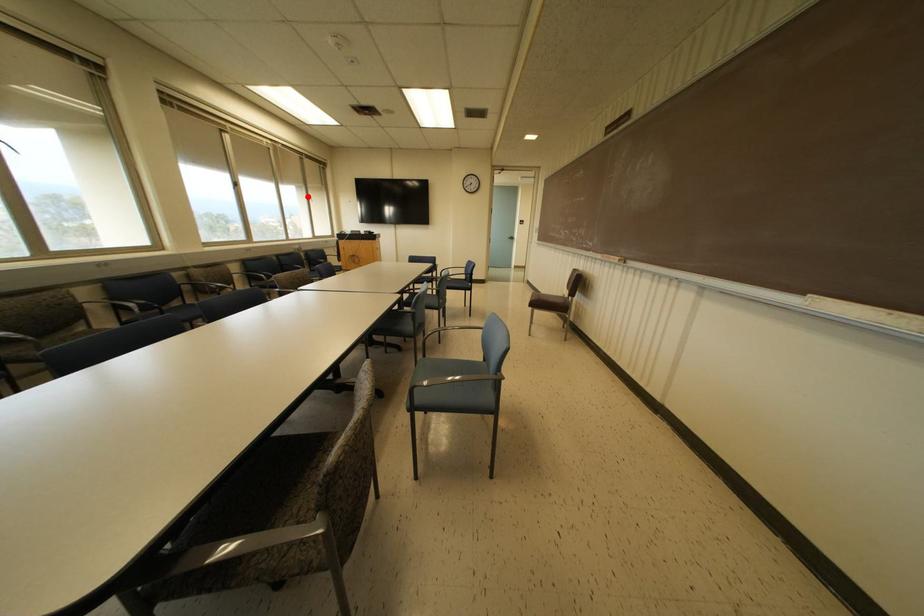
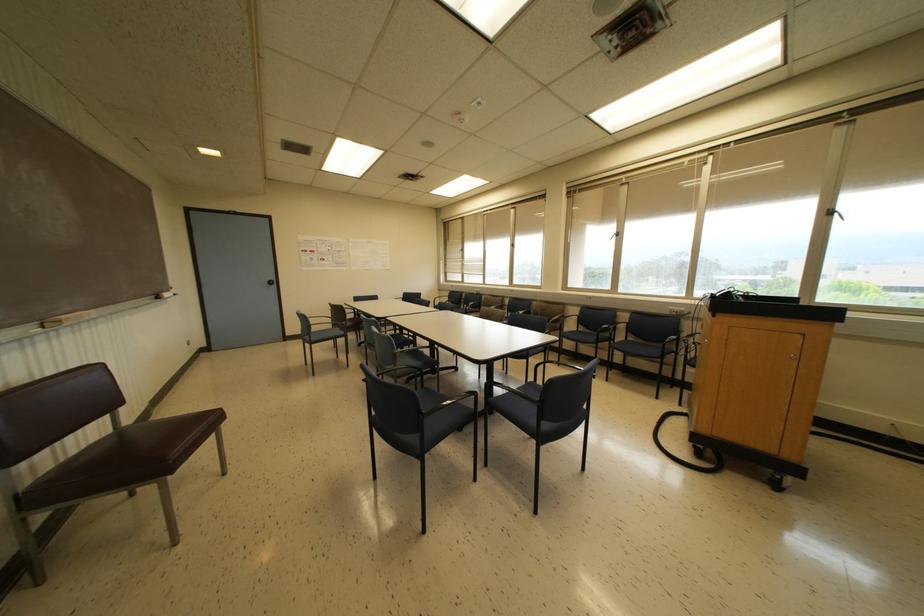
Where in the second image is the point corresponding to the highlighted location from the first image?

(827, 213)